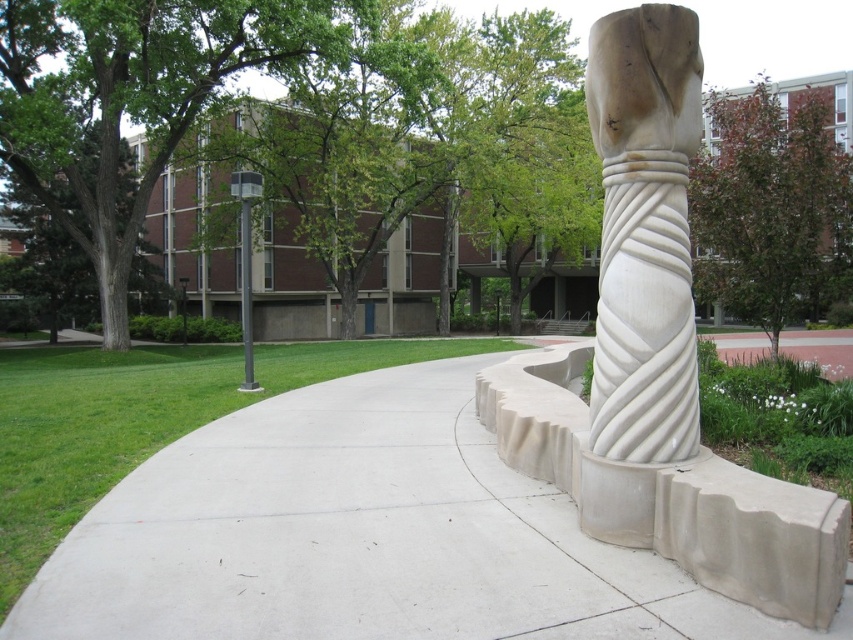
Is white marble column at center thinner than metallic pole at upper left?

Indeed, white marble column at center has a lesser width compared to metallic pole at upper left.

Is white marble column at center further to camera compared to metallic pole at upper left?

No, it is in front of metallic pole at upper left.

I want to click on white marble column at center, so click(643, 232).

Locate an element on the screen. The height and width of the screenshot is (640, 853). white concrete pavement at center is located at coordinates (361, 536).

Measure the distance between point (379, 464) and camera.

Point (379, 464) and camera are 6.76 meters apart.

The width and height of the screenshot is (853, 640). Find the location of `white concrete pavement at center`. white concrete pavement at center is located at coordinates (361, 536).

Is white concrete pavement at center thinner than metallic pole at upper left?

Correct, white concrete pavement at center's width is less than metallic pole at upper left's.

Does white concrete pavement at center appear on the right side of metallic pole at upper left?

Indeed, white concrete pavement at center is positioned on the right side of metallic pole at upper left.

Does point (194, 602) come in front of point (253, 186)?

Yes, it is in front of point (253, 186).

At what (x,y) coordinates should I click in order to perform the action: click on white concrete pavement at center. Please return your answer as a coordinate pair (x, y). The height and width of the screenshot is (640, 853). Looking at the image, I should click on (361, 536).